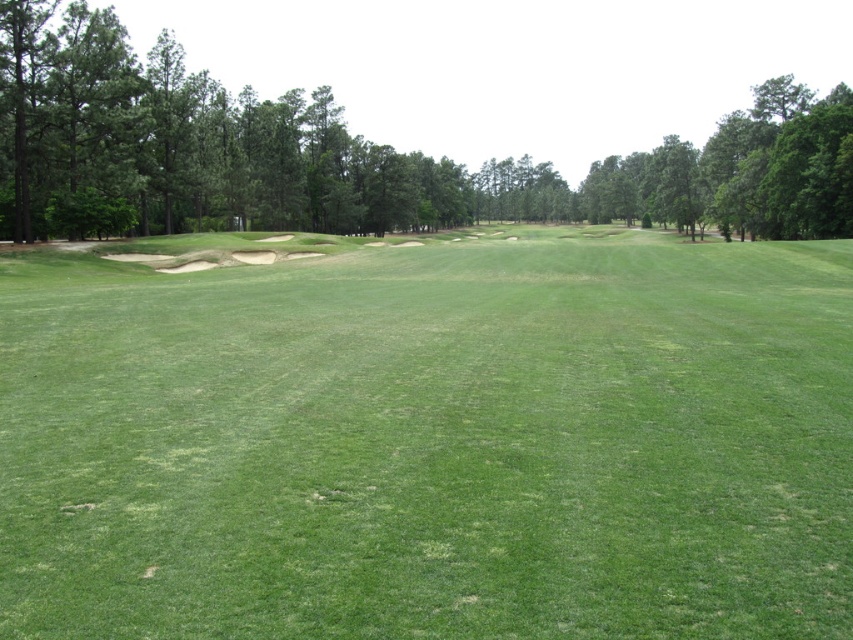
Looking at this image, you are a golfer standing on the tee box preparing to hit your first shot. You notice the green grassy field at center and the green leafy tree at center. Which object is closer to you as you stand on the tee box?

The green grassy field at center is closer to you because it is positioned in front of the green leafy tree at center.

You are a golfer standing on the tee box preparing to hit your first shot. You notice the green grassy field at center and the green leafy tree at center. Which object is closer to you?

The green grassy field at center is positioned under the green leafy tree at center, meaning the tree is closer to you as it is above the field.

You are a golfer standing on the tee and want to hit your ball to the green. You notice the green grassy field at center and the green leafy tree at center. Which of these two objects is wider from your perspective?

The green leafy tree at center is wider than the green grassy field at center from your perspective.